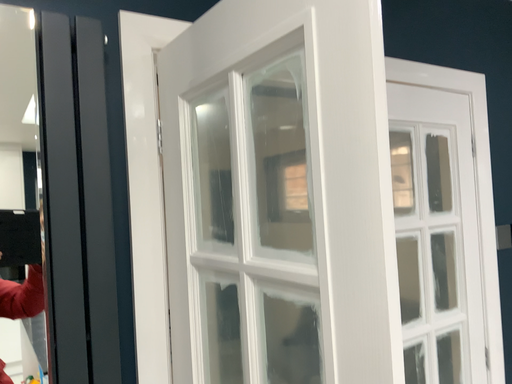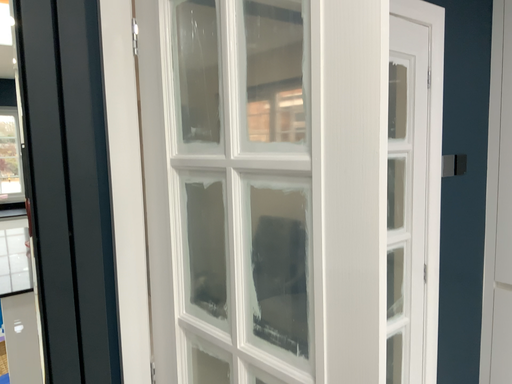
Question: How did the camera likely rotate when shooting the video?

Choices:
 (A) rotated left
 (B) rotated right

Answer: (B)